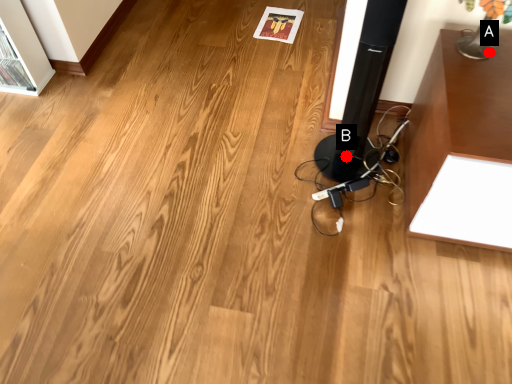
Question: Two points are circled on the image, labeled by A and B beside each circle. Which of the following is the closest to the observer?

Choices:
 (A) A is closer
 (B) B is closer

Answer: (A)